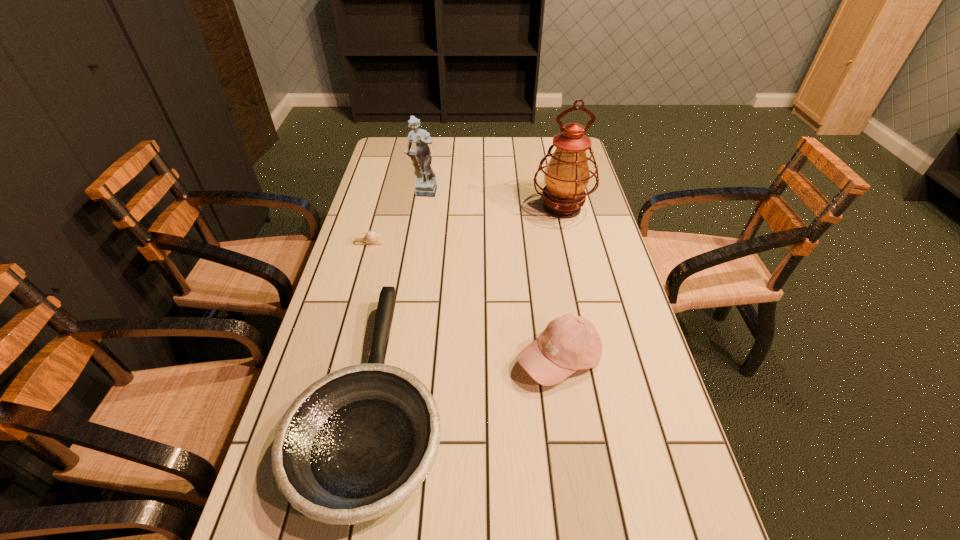
Locate an element on the screen. The image size is (960, 540). vacant space located 0.300m on the handle side of the second shortest object is located at coordinates (406, 234).

What are the coordinates of `vacant space located 0.070m on the handle side of the second shortest object` in the screenshot? It's located at (396, 285).

Identify the location of vacant point located on the shell of the escargot. This screenshot has height=540, width=960. (399, 242).

I want to click on figurine located in the left edge section of the desktop, so click(x=426, y=185).

Find the location of `frying pan at the left edge`. frying pan at the left edge is located at coordinates (354, 445).

Where is `escargot that is at the left edge`? The width and height of the screenshot is (960, 540). escargot that is at the left edge is located at coordinates (371, 237).

Identify the location of oil lamp present at the right edge. This screenshot has height=540, width=960. (567, 175).

Where is `baseball cap that is at the right edge`? The width and height of the screenshot is (960, 540). baseball cap that is at the right edge is located at coordinates (569, 343).

This screenshot has height=540, width=960. In the image, there is a desktop. Find the location of `blank space at the far edge`. blank space at the far edge is located at coordinates (467, 141).

At what (x,y) coordinates should I click in order to perform the action: click on free space at the left edge of the desktop. Please return your answer as a coordinate pair (x, y). This screenshot has height=540, width=960. Looking at the image, I should click on (378, 186).